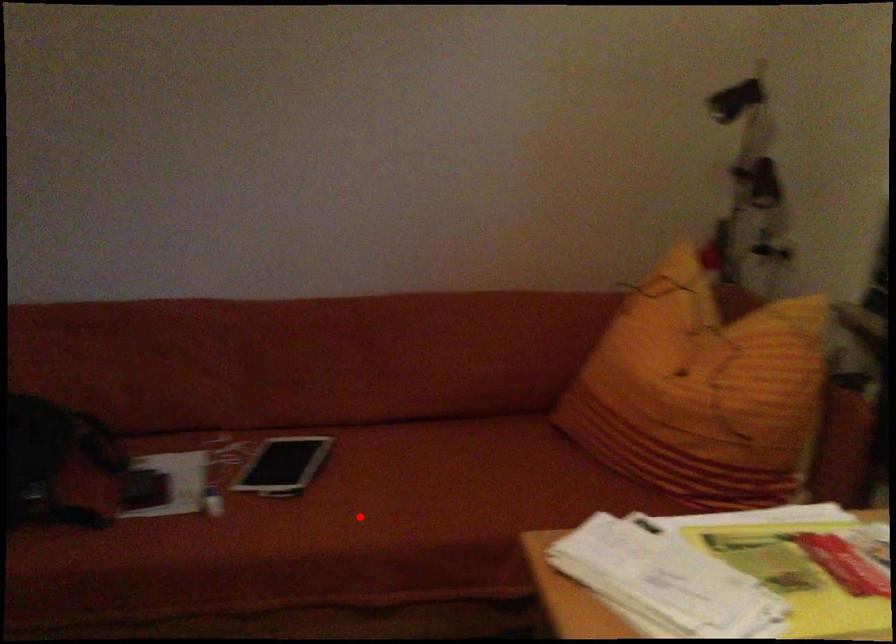
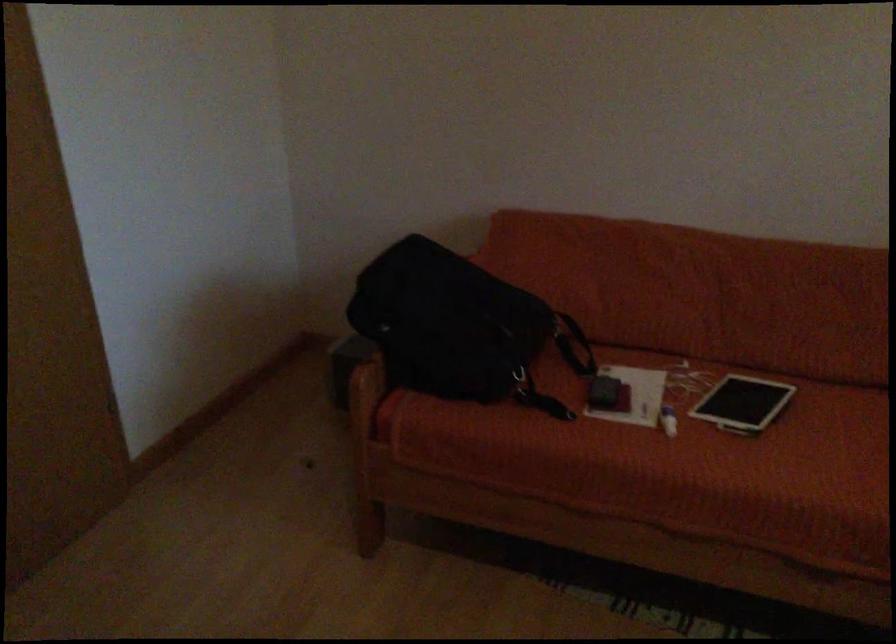
Question: I am providing you with two images of the same scene from different viewpoints. A red point is marked on the first image. Is the red point's position out of view in image 2?

Choices:
 (A) Yes
 (B) No

Answer: (B)